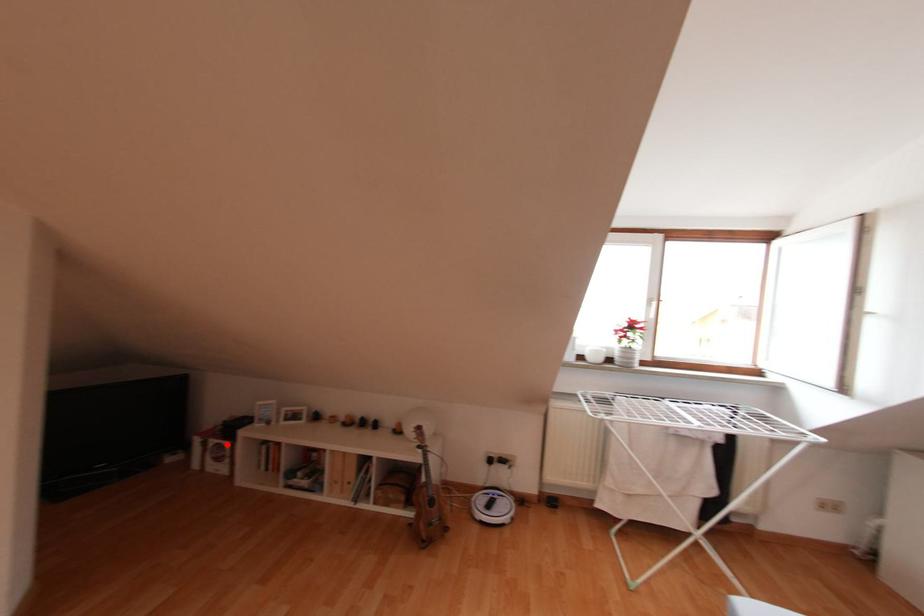
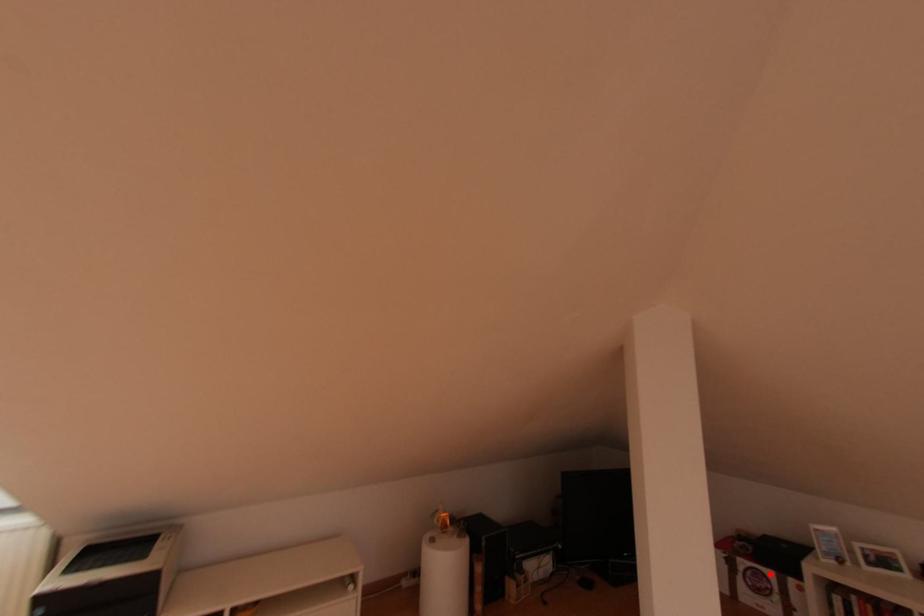
I am providing you with two images of the same scene from different viewpoints. A red point is marked on the first image and another point is marked on the second image. Are the points marked in image1 and image2 representing the same 3D position?

Yes